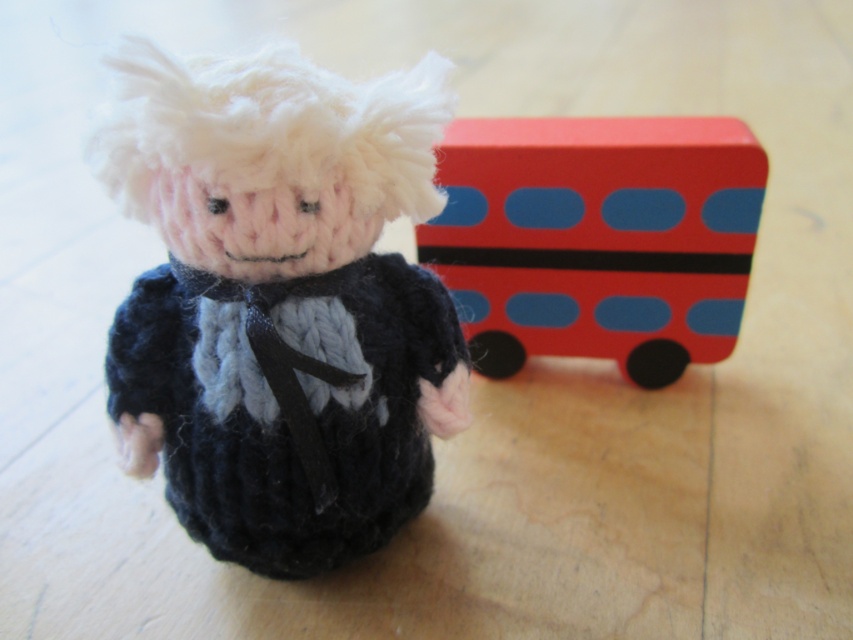
Can you confirm if knitted wool doll at center is smaller than smooth plastic bus at right?

Actually, knitted wool doll at center might be larger than smooth plastic bus at right.

Between knitted wool doll at center and smooth plastic bus at right, which one is positioned higher?

smooth plastic bus at right is higher up.

Between point (146, 340) and point (699, 225), which one is positioned in front?

Point (146, 340)

Locate an element on the screen. knitted wool doll at center is located at coordinates [280, 301].